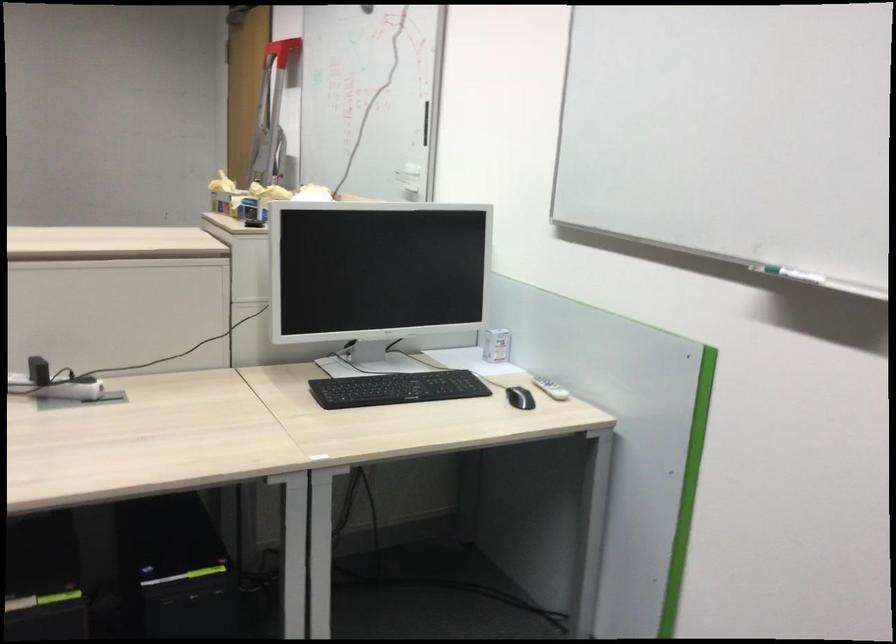
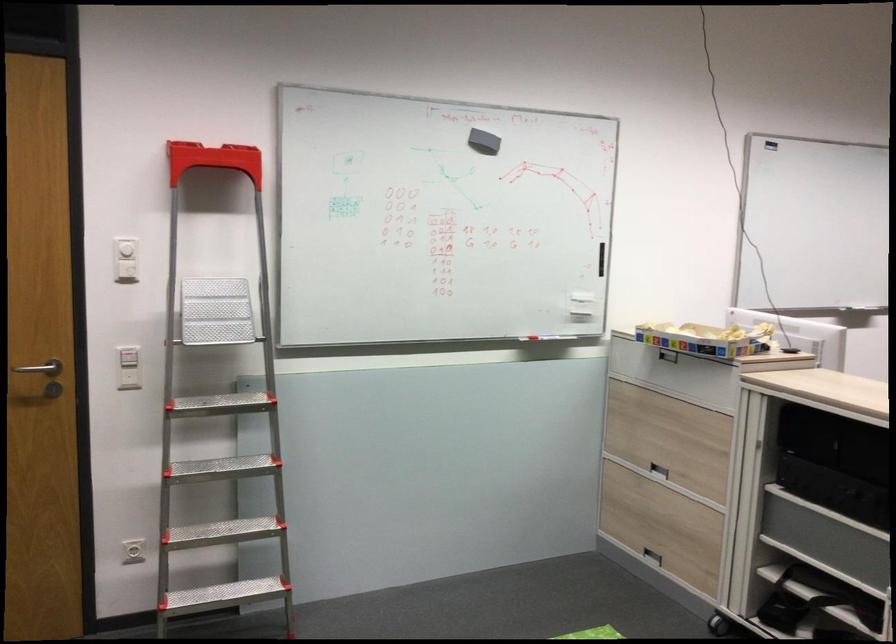
Question: I am providing you with two images of the same scene from different viewpoints. Which of the following objects are not visible in image2?

Choices:
 (A) small white box
 (B) white power outlet
 (C) red whiteboard marker
 (D) silver door handle

Answer: (A)